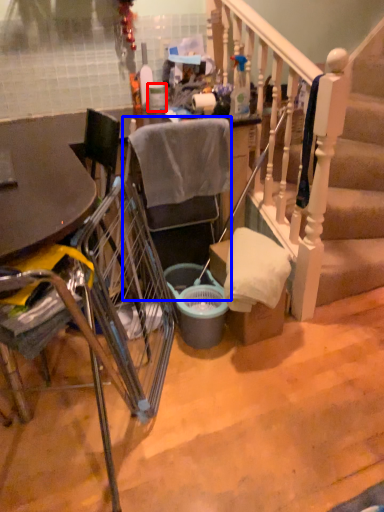
Question: Among these objects, which one is farthest to the camera, trash bin/can (highlighted by a red box) or chair (highlighted by a blue box)?

Choices:
 (A) trash bin/can
 (B) chair

Answer: (A)